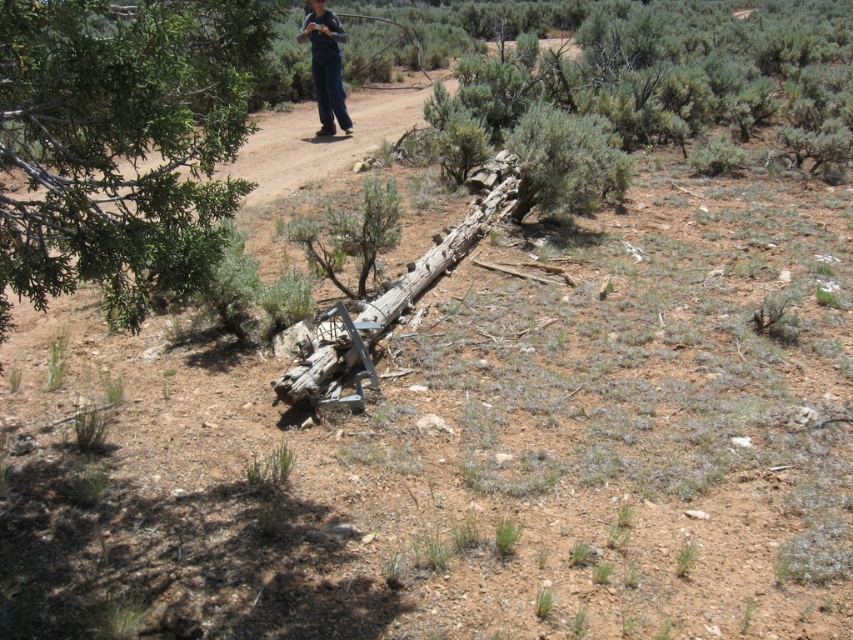
Question: Can you confirm if green leafy branch at upper left is smaller than dark blue jeans at upper center?

Choices:
 (A) yes
 (B) no

Answer: (B)

Question: Can you confirm if green leafy branch at upper left is positioned above dark blue jeans at upper center?

Choices:
 (A) yes
 (B) no

Answer: (B)

Question: Does green leafy branch at upper left have a greater width compared to dark blue jeans at upper center?

Choices:
 (A) yes
 (B) no

Answer: (A)

Question: Which point is closer to the camera?

Choices:
 (A) dark blue jeans at upper center
 (B) green leafy branch at upper left

Answer: (B)

Question: Which object appears farthest from the camera in this image?

Choices:
 (A) dark blue jeans at upper center
 (B) green leafy branch at upper left

Answer: (A)